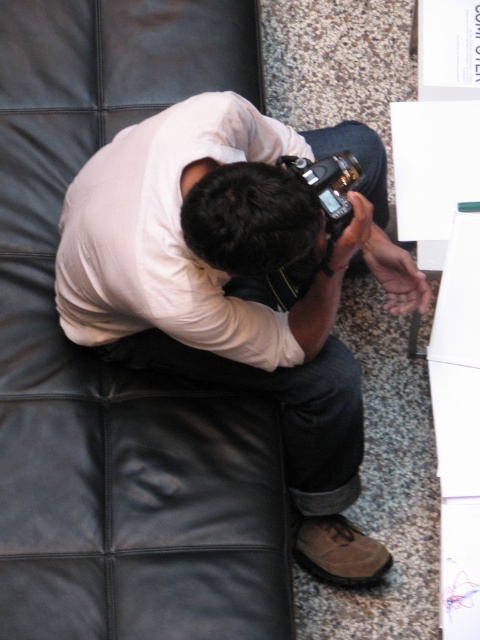
In the scene shown: You are standing in front of the scene and want to know which of the two points, point (x=124, y=10) or point (x=321, y=525), is nearer to you. Can you determine this based on the description?

Point (x=124, y=10) is closer to the camera than point (x=321, y=525), so it is the nearer one.

You are a photographer trying to capture the scene from the current viewpoint. Which object, the black leather couch at upper left or the white matte shirt at center, will appear larger in your photo?

The black leather couch at upper left will appear larger in the photo because it is closer to the viewer than the white matte shirt at center.